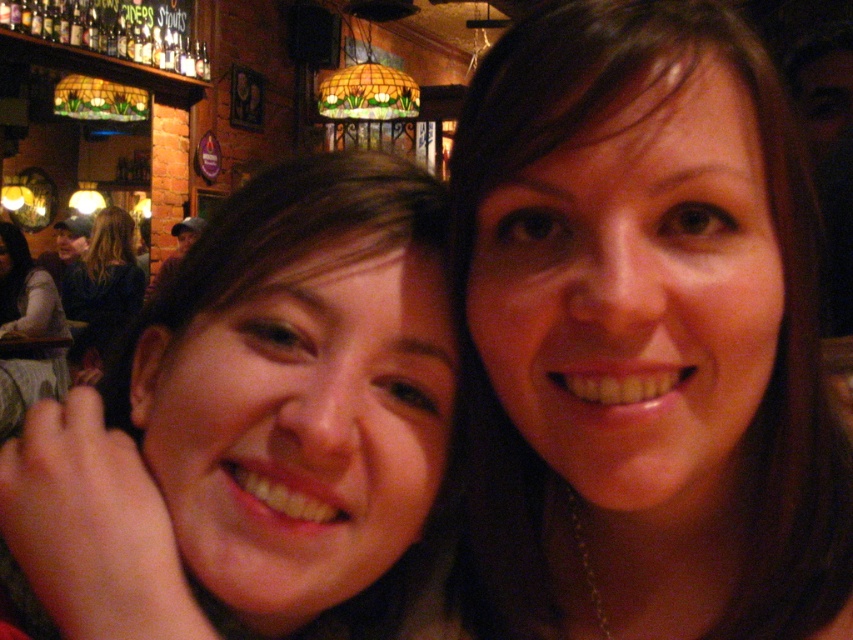
You are a photographer adjusting the camera height to ensure both the brown hair at center and the light brown hair at upper left are clearly visible. Which person should you position the camera closer to?

The brown hair at center is shorter than the light brown hair at upper left, so you should position the camera closer to the brown hair at center to ensure both are clearly visible.

You are a photographer adjusting the focus of your camera. You want to ensure that the smooth skin face at center is in sharp focus. According to the coordinates provided, where exactly should you aim the focus point?

You should aim the focus point at the coordinates point (297, 392) to ensure the smooth skin face at center is in sharp focus.

You are a photographer trying to capture a clear shot of both the brown hair at center and the light brown hair at upper left. Which of the two hair colors is located lower in the frame?

The brown hair at center is positioned over light brown hair at upper left, meaning the light brown hair at upper left is lower in the frame.